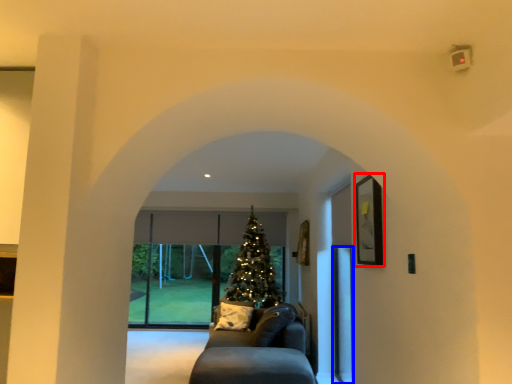
Question: Which object is closer to the camera taking this photo, picture frame (highlighted by a red box) or screen door (highlighted by a blue box)?

Choices:
 (A) picture frame
 (B) screen door

Answer: (A)